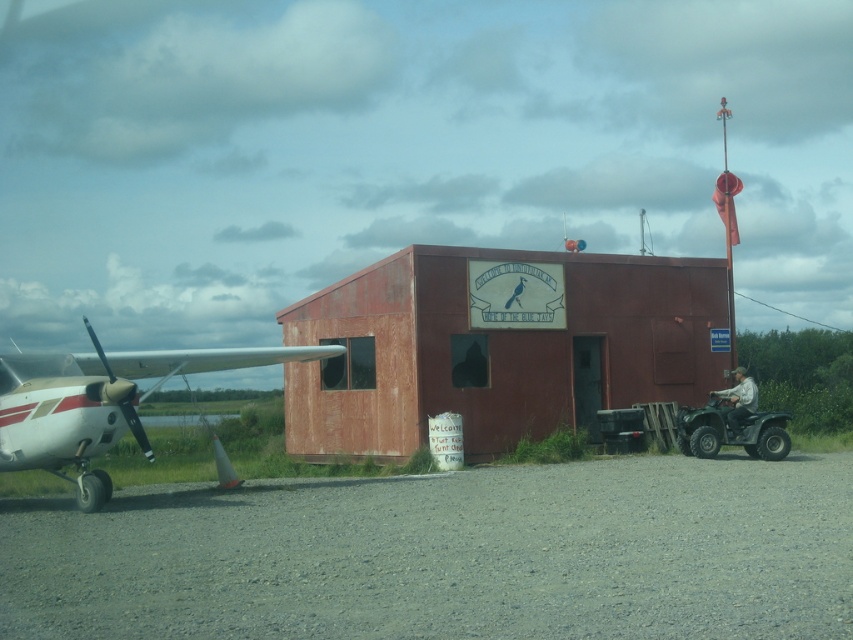
Which of these two, rusty wood hangar at center or white glossy airplane at left, stands taller?

Standing taller between the two is rusty wood hangar at center.

Is rusty wood hangar at center behind white glossy airplane at left?

That is True.

Who is more distant from viewer, (317, 429) or (218, 358)?

Point (317, 429)

Find the location of `rusty wood hangar at center`. rusty wood hangar at center is located at coordinates (496, 346).